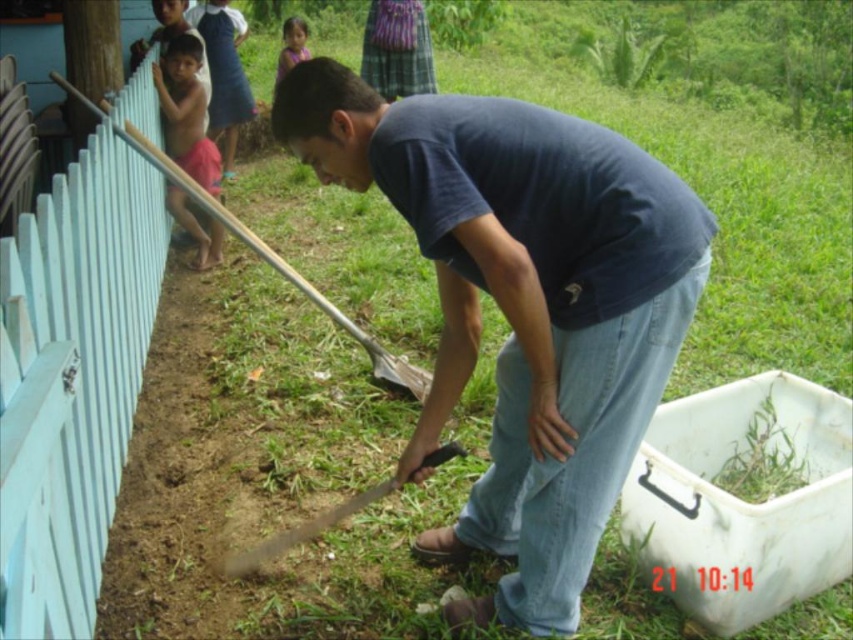
Question: Which point is closer to the camera taking this photo?

Choices:
 (A) (296, 38)
 (B) (519, 433)
 (C) (51, 184)

Answer: (B)

Question: Does light blue wooden fence at left appear over shiny pink shorts at left?

Choices:
 (A) yes
 (B) no

Answer: (B)

Question: Does light blue wooden fence at left appear over shiny pink shorts at left?

Choices:
 (A) no
 (B) yes

Answer: (A)

Question: Is light blue wooden fence at left thinner than smooth skin child at upper center?

Choices:
 (A) yes
 (B) no

Answer: (B)

Question: Among these objects, which one is farthest from the camera?

Choices:
 (A) dark blue t-shirt at center
 (B) shiny pink shorts at left
 (C) smooth skin child at upper center

Answer: (C)

Question: Which of the following is the closest to the observer?

Choices:
 (A) pyautogui.click(x=602, y=230)
 (B) pyautogui.click(x=340, y=508)
 (C) pyautogui.click(x=4, y=401)
 (D) pyautogui.click(x=302, y=35)

Answer: (C)